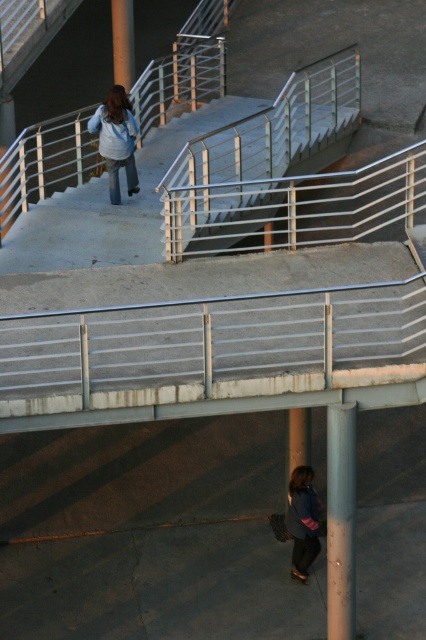
You are standing at the bottom of the staircase and want to reach the metallic silver handrail at upper left. Based on the coordinates provided, in which direction should you move relative to the staircase?

The metallic silver handrail at upper left is located at coordinates point (111, 205), so you should move towards the upper left direction relative to the staircase to reach it.

You are standing at the base of the staircase and want to reach the point marked as point (345, 420). If you walk straight ahead, will you reach this point before the stairs end?

The point (345, 420) is 48.66 feet away from the viewer. Since the stairs curve slightly to the right at the top, you might not reach the point before the stairs end if they curve away from the direct path. However, the exact distance isn

You are standing at the bottom of the staircase and want to reach the smooth concrete pillar at upper center. There is a sanded concrete pole at lower right in your path. Which direction should you move to avoid it?

To reach the smooth concrete pillar at upper center while avoiding the sanded concrete pole at lower right, you should move to the left since the sanded concrete pole at lower right is positioned to the right of the pillar.